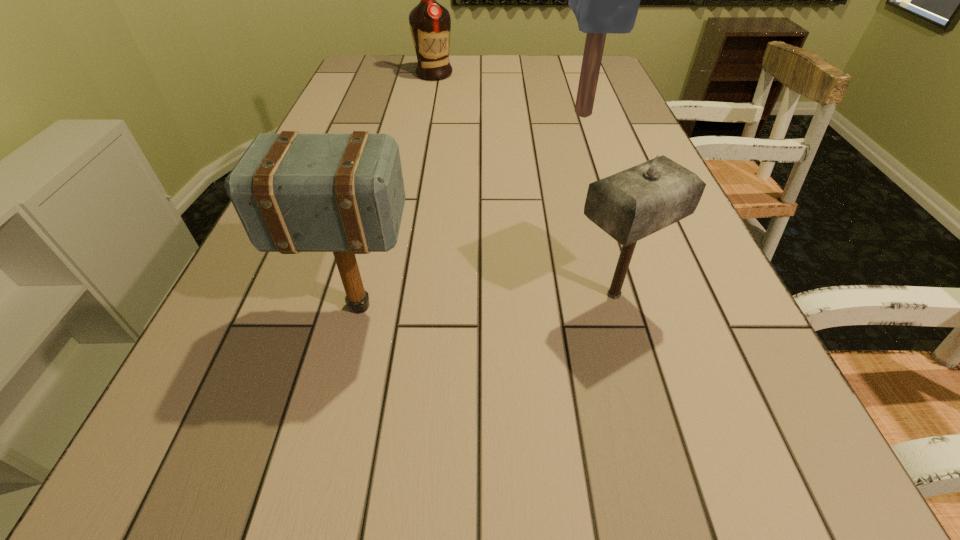
The width and height of the screenshot is (960, 540). In the image, there is a desktop. Find the location of `vacant space at the left edge`. vacant space at the left edge is located at coordinates (307, 271).

You are a GUI agent. You are given a task and a screenshot of the screen. Output one action in this format:
    pyautogui.click(x=<x>, y=<y>)
    Task: Click on the vacant space at the right edge of the desktop
    
    Given the screenshot: What is the action you would take?
    pyautogui.click(x=661, y=306)

You are a GUI agent. You are given a task and a screenshot of the screen. Output one action in this format:
    pyautogui.click(x=<x>, y=<y>)
    Task: Click on the unoccupied area between the farthest mallet and the farthest object
    
    Given the screenshot: What is the action you would take?
    pyautogui.click(x=508, y=94)

Where is `free space between the farthest mallet and the leftmost mallet`? This screenshot has width=960, height=540. free space between the farthest mallet and the leftmost mallet is located at coordinates click(x=470, y=210).

I want to click on blank region between the second farthest object and the leftmost mallet, so click(470, 210).

Locate an element on the screen. The height and width of the screenshot is (540, 960). vacant area between the leftmost mallet and the tallest mallet is located at coordinates (470, 210).

Point out which object is positioned as the third nearest to the leftmost mallet. Please provide its 2D coordinates. Your answer should be formatted as a tuple, i.e. [(x, y)], where the tuple contains the x and y coordinates of a point satisfying the conditions above.

[(430, 23)]

Select which object is the third closest to the liquor. Please provide its 2D coordinates. Your answer should be formatted as a tuple, i.e. [(x, y)], where the tuple contains the x and y coordinates of a point satisfying the conditions above.

[(630, 205)]

What are the coordinates of `the second closest mallet relative to the leftmost mallet` in the screenshot? It's located at (604, 0).

Locate an element on the screen. Image resolution: width=960 pixels, height=540 pixels. mallet that is the second closest one to the second farthest object is located at coordinates (343, 193).